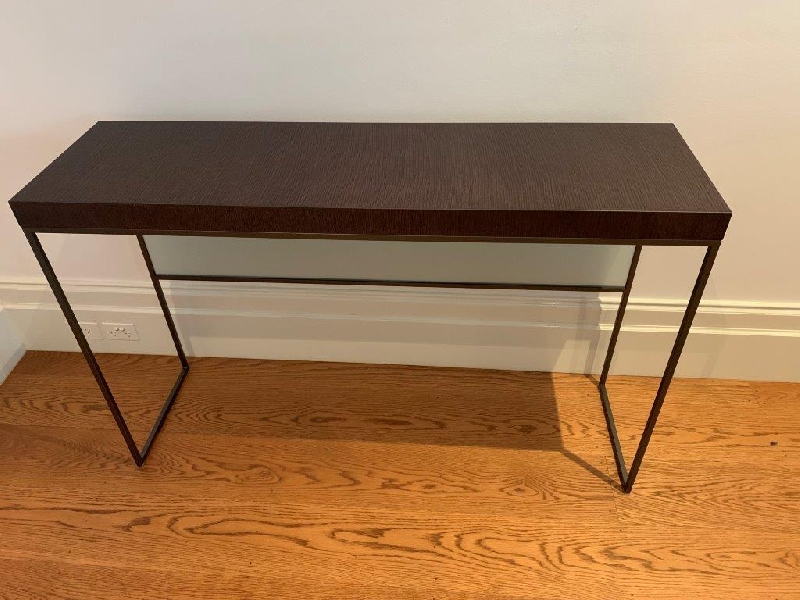
At what (x,y) coordinates should I click in order to perform the action: click on white wall. Please return your answer as a coordinate pair (x, y). This screenshot has height=600, width=800. Looking at the image, I should click on (152, 60).